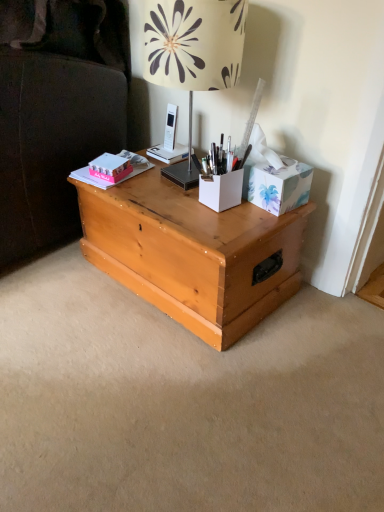
The image size is (384, 512). Find the location of `free space in front of beige floral lampshade at upper center`. free space in front of beige floral lampshade at upper center is located at coordinates (200, 214).